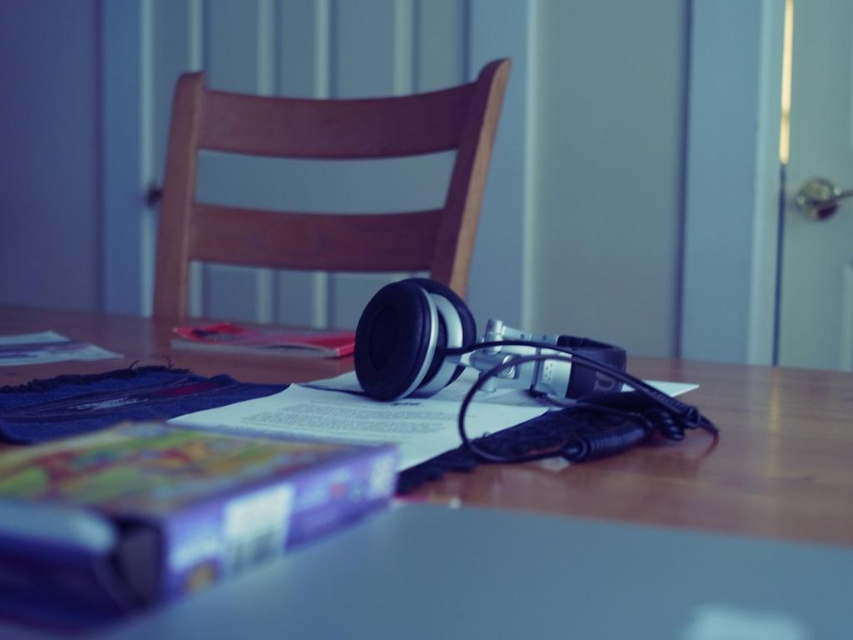
Question: Which point is farther to the camera?

Choices:
 (A) matte plastic book at lower left
 (B) wooden table at center

Answer: (A)

Question: Among these objects, which one is nearest to the camera?

Choices:
 (A) wooden table at center
 (B) matte plastic book at lower left
 (C) red matte book at center
 (D) wooden chair at center

Answer: (A)

Question: Where is wooden table at center located in relation to red matte book at center in the image?

Choices:
 (A) right
 (B) left

Answer: (A)

Question: Which object is farther from the camera taking this photo?

Choices:
 (A) wooden table at center
 (B) wooden chair at center
 (C) red matte book at center

Answer: (B)

Question: Can you confirm if wooden table at center is bigger than wooden chair at center?

Choices:
 (A) no
 (B) yes

Answer: (A)

Question: Is wooden table at center wider than red matte book at center?

Choices:
 (A) no
 (B) yes

Answer: (B)